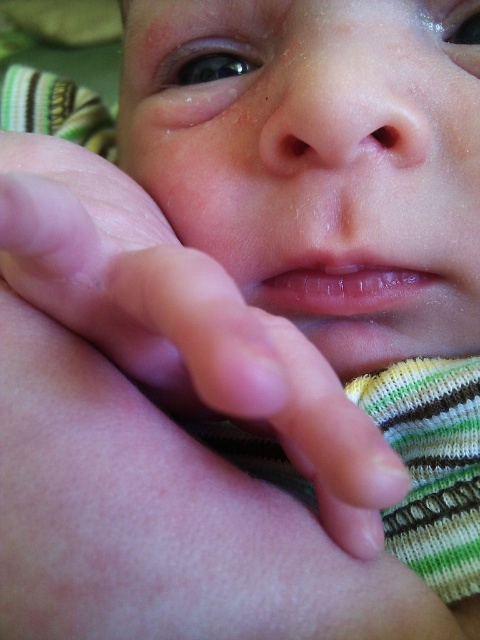
You are a photographer taking a closeup shot of a baby. You notice two areas of interest labeled as smooth skin baby at center and pink flesh at center. Which area is closer to the camera lens?

The smooth skin baby at center is closer to the camera lens because the pink flesh at center is positioned behind it.

You are a pediatrician examining a newborn. You observe the smooth skin baby at center and the pink flesh at center. Which of these two areas is larger in height?

The smooth skin baby at center is much taller than the pink flesh at center.

Based on the scene description, which object is positioned higher in the image between the smooth skin baby at center and the pink flesh at center?

The smooth skin baby at center is positioned higher than the pink flesh at center according to the description.